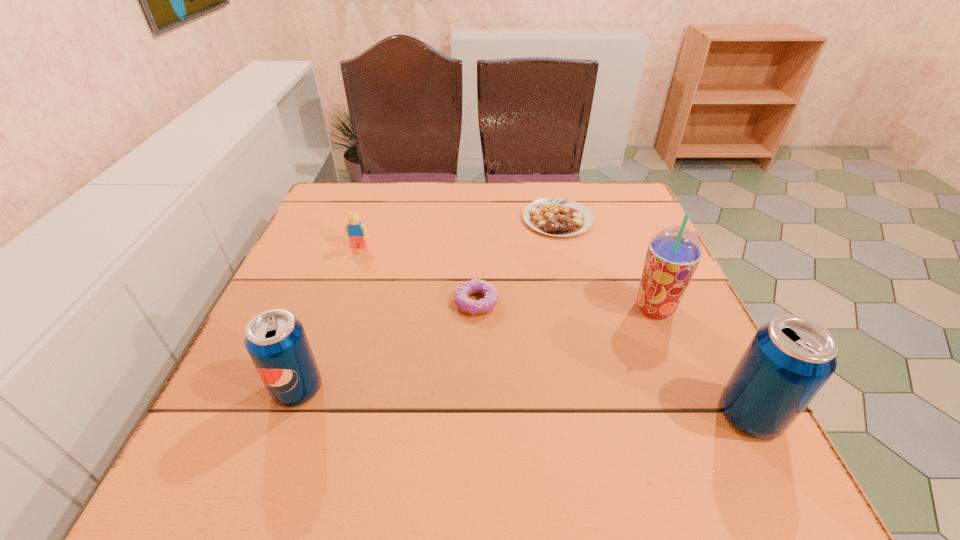
To make them evenly spaced by inserting another pop_(soda) among them, please locate a free space for this new pop_(soda). Please provide its 2D coordinates. Your answer should be formatted as a tuple, i.e. [(x, y)], where the tuple contains the x and y coordinates of a point satisfying the conditions above.

[(518, 401)]